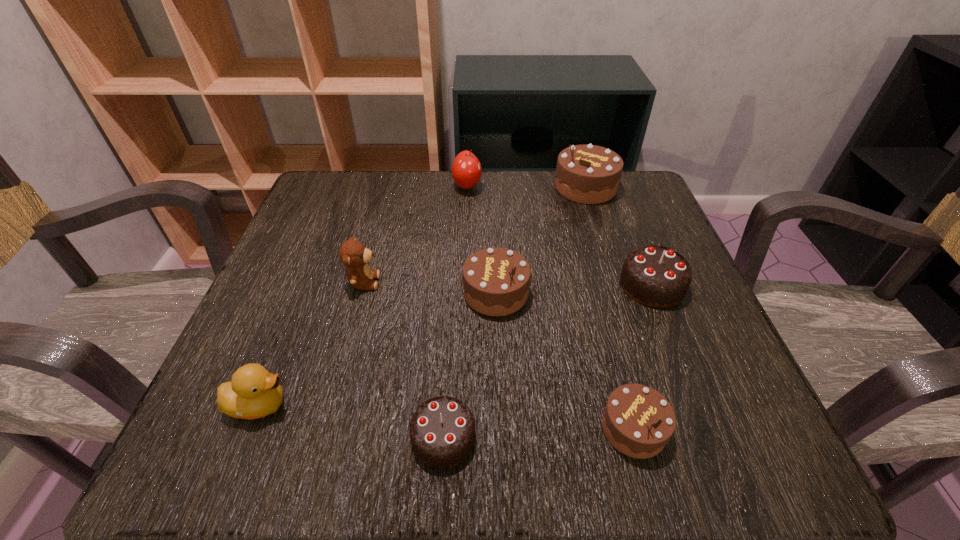
In order to click on free space located on the back of the nearer chocolate chocolate cake in this screenshot , I will do `click(454, 262)`.

This screenshot has width=960, height=540. Find the location of `chocolate cake at the far edge`. chocolate cake at the far edge is located at coordinates (588, 174).

Locate an element on the screen. The image size is (960, 540). apple present at the far edge is located at coordinates (466, 170).

Find the location of `duckling that is at the near edge`. duckling that is at the near edge is located at coordinates tap(253, 392).

The height and width of the screenshot is (540, 960). In order to click on teddy bear that is at the left edge in this screenshot , I will do `click(353, 254)`.

The height and width of the screenshot is (540, 960). Find the location of `duckling at the left edge`. duckling at the left edge is located at coordinates (253, 392).

The height and width of the screenshot is (540, 960). Find the location of `object present at the near left corner`. object present at the near left corner is located at coordinates (253, 392).

Image resolution: width=960 pixels, height=540 pixels. Identify the location of object that is positioned at the far right corner. tap(588, 174).

At what (x,y) coordinates should I click in order to perform the action: click on object present at the near right corner. Please return your answer as a coordinate pair (x, y). Looking at the image, I should click on point(638,421).

This screenshot has width=960, height=540. In order to click on vacant region at the far edge of the desktop in this screenshot , I will do `click(414, 209)`.